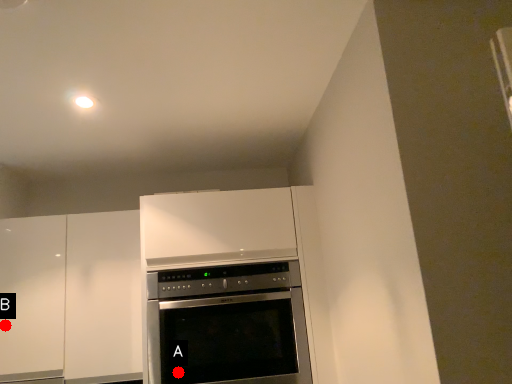
Question: Two points are circled on the image, labeled by A and B beside each circle. Which point appears farthest from the camera in this image?

Choices:
 (A) A is further
 (B) B is further

Answer: (B)